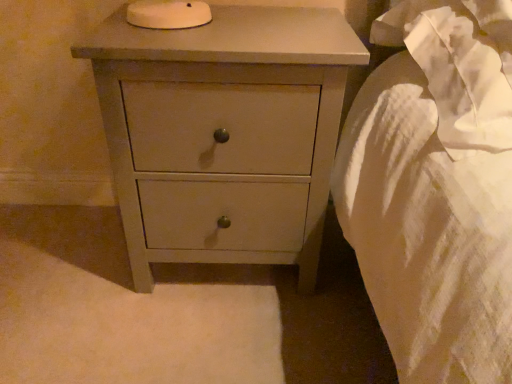
Image resolution: width=512 pixels, height=384 pixels. What do you see at coordinates (224, 123) in the screenshot?
I see `matte gray chest of drawers at center` at bounding box center [224, 123].

This screenshot has height=384, width=512. In order to click on matte gray chest of drawers at center in this screenshot , I will do [224, 123].

Where is `matte gray chest of drawers at center`? Image resolution: width=512 pixels, height=384 pixels. matte gray chest of drawers at center is located at coordinates (224, 123).